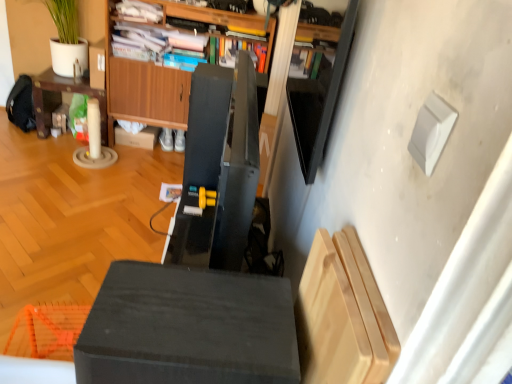
Question: Could you tell me if matte black cube at center is facing brown cardboard box at center?

Choices:
 (A) yes
 (B) no

Answer: (B)

Question: Does matte black cube at center have a greater width compared to brown cardboard box at center?

Choices:
 (A) yes
 (B) no

Answer: (A)

Question: Does matte black cube at center have a larger size compared to brown cardboard box at center?

Choices:
 (A) no
 (B) yes

Answer: (B)

Question: From a real-world perspective, is matte black cube at center located higher than brown cardboard box at center?

Choices:
 (A) no
 (B) yes

Answer: (B)

Question: Does matte black cube at center come behind brown cardboard box at center?

Choices:
 (A) yes
 (B) no

Answer: (B)

Question: Is matte black cube at center thinner than brown cardboard box at center?

Choices:
 (A) yes
 (B) no

Answer: (B)

Question: Could you tell me if matte brown table at left is facing matte black cube at center?

Choices:
 (A) no
 (B) yes

Answer: (B)

Question: Considering the relative sizes of matte brown table at left and matte black cube at center in the image provided, is matte brown table at left shorter than matte black cube at center?

Choices:
 (A) no
 (B) yes

Answer: (A)

Question: Is matte brown table at left oriented away from matte black cube at center?

Choices:
 (A) yes
 (B) no

Answer: (B)

Question: Is matte brown table at left at the right side of matte black cube at center?

Choices:
 (A) yes
 (B) no

Answer: (B)

Question: Is matte brown table at left taller than matte black cube at center?

Choices:
 (A) no
 (B) yes

Answer: (B)

Question: Is matte black cube at center completely or partially inside matte brown table at left?

Choices:
 (A) no
 (B) yes

Answer: (A)

Question: Is wooden cabinet at center outside matte black cube at center?

Choices:
 (A) yes
 (B) no

Answer: (A)